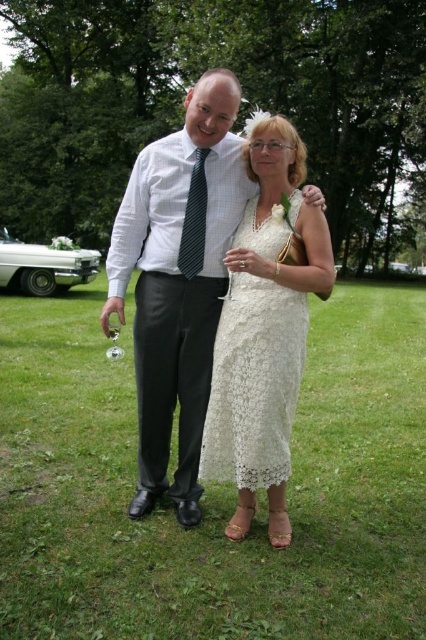
You are a photographer at a wedding reception. You want to take a photo of the matte white shirt at center and white lace dress at center so that both are clearly visible. Given their current positions, is there any adjustment needed to ensure both are visible in the frame?

The white lace dress at center is behind the matte white shirt at center, so you should move the white lace dress at center forward or adjust their positions to ensure both are visible in the frame.

You are a photographer at a wedding and you see the white lace dress at center and the striped fabric tie at center. Which one is closer to the ground?

The white lace dress at center is closer to the ground because it is below the striped fabric tie at center.